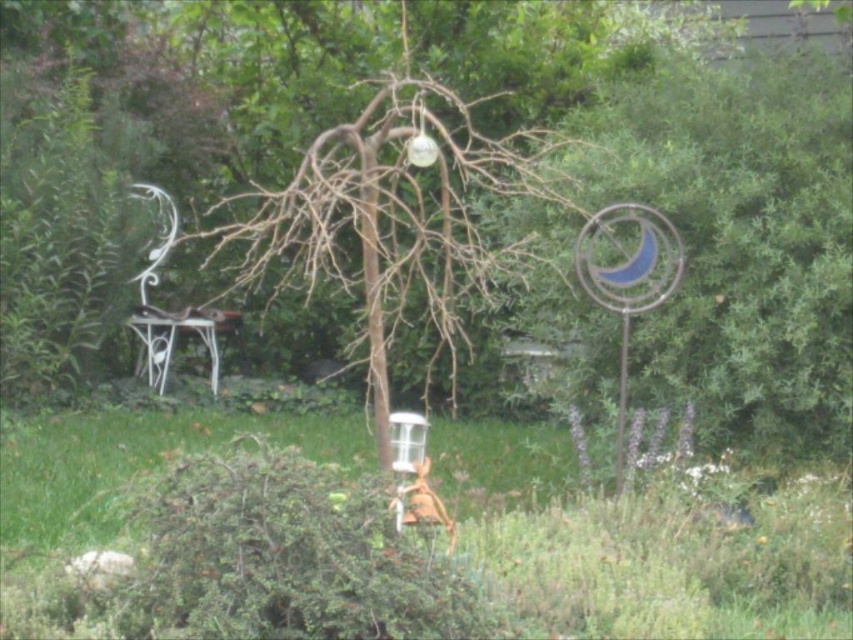
You are planning to place a new bench in the garden. The bench is as wide as the white wrought iron chair at left. Can the bench fit between the brown wood tree at center and the nearest garden wall without touching the tree?

The brown wood tree at center is wider than the white wrought iron chair at left. Since the bench is as wide as the chair, it might not fit between the tree and the wall if the space is constrained by the tree width. However, without knowing the exact distance to the wall, it is hard to determine. Please check the available space.

Based on the photo, you are standing in the garden and want to place a new decorative item between the metallic wire sculpture at right and the viewer. The item you have is 3 meters long. Is there enough space to place it without overlapping either the sculpture or the viewer?

The distance between the metallic wire sculpture at right and the viewer is 6.92 meters. Since the decorative item is 3 meters long, there is sufficient space to place it in between without overlapping either end.